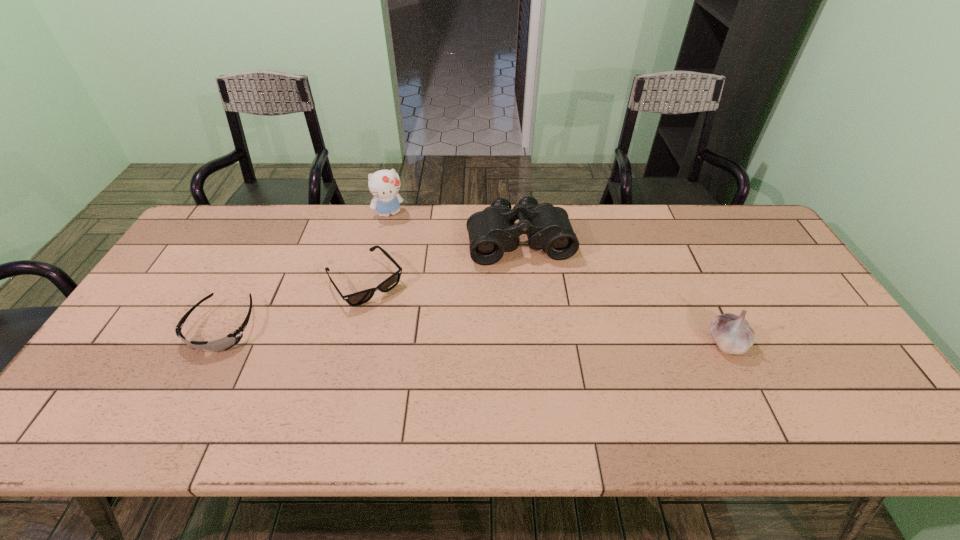
Image resolution: width=960 pixels, height=540 pixels. What are the coordinates of `free space on the desktop that is between the leftmost object and the garlic and is positioned on the front-facing side of the tallest object` in the screenshot? It's located at (446, 334).

Locate an element on the screen. vacant space on the desktop that is between the left sunglasses and the rightmost object and is positioned at the eyepieces of the second object from right to left is located at coordinates (543, 336).

The height and width of the screenshot is (540, 960). What are the coordinates of `free space on the desktop that is between the leftmost object and the garlic and is positioned on the front-facing side of the taller sunglasses` in the screenshot? It's located at (407, 333).